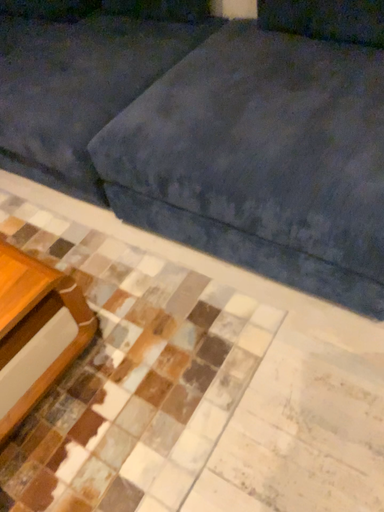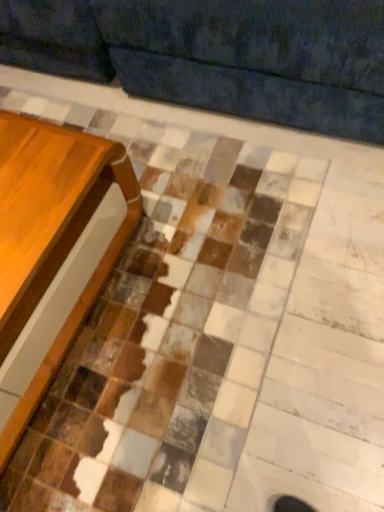
Question: Which way did the camera rotate in the video?

Choices:
 (A) rotated upward
 (B) rotated downward

Answer: (B)